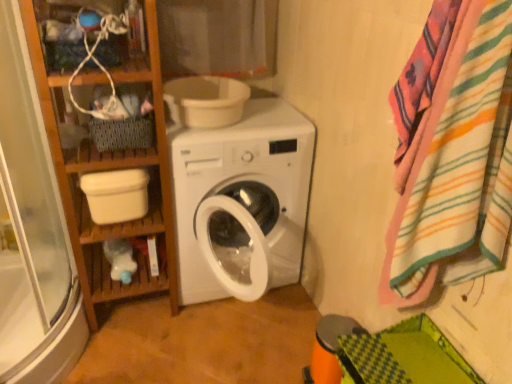
Find the location of a particular element. This screenshot has width=512, height=384. vacant space in between white plastic bowl at upper center, the first toilet bowl from the right, and cotton curtain at upper center is located at coordinates (262, 115).